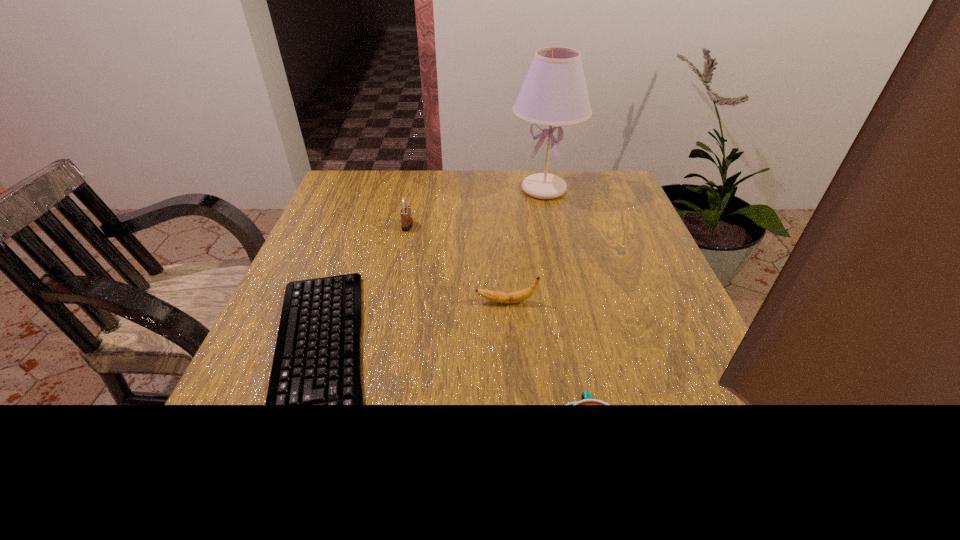
I want to click on the tallest object, so click(554, 92).

Image resolution: width=960 pixels, height=540 pixels. Identify the location of lampshade. (554, 92).

You are a GUI agent. You are given a task and a screenshot of the screen. Output one action in this format:
    pyautogui.click(x=<x>, y=<y>)
    Task: Click on the padlock
    This screenshot has width=960, height=540.
    Given the screenshot: What is the action you would take?
    tap(407, 222)

The image size is (960, 540). Identify the location of the second farthest object. (407, 222).

Locate an element on the screen. banana is located at coordinates (517, 296).

The height and width of the screenshot is (540, 960). I want to click on cappuccino, so click(586, 397).

The height and width of the screenshot is (540, 960). I want to click on computer keyboard, so click(x=317, y=360).

At what (x,y) coordinates should I click in order to perform the action: click on free region located on the front of the lampshade. Please return your answer as a coordinate pair (x, y). This screenshot has width=960, height=540. Looking at the image, I should click on (551, 223).

Where is `vacant position located 0.060m on the back of the second farthest object`? The image size is (960, 540). vacant position located 0.060m on the back of the second farthest object is located at coordinates (412, 207).

You are a GUI agent. You are given a task and a screenshot of the screen. Output one action in this format:
    pyautogui.click(x=<x>, y=<y>)
    Task: Click on the free region located on the peel of the banana from the top
    Image resolution: width=960 pixels, height=540 pixels.
    Given the screenshot: What is the action you would take?
    pyautogui.click(x=302, y=302)